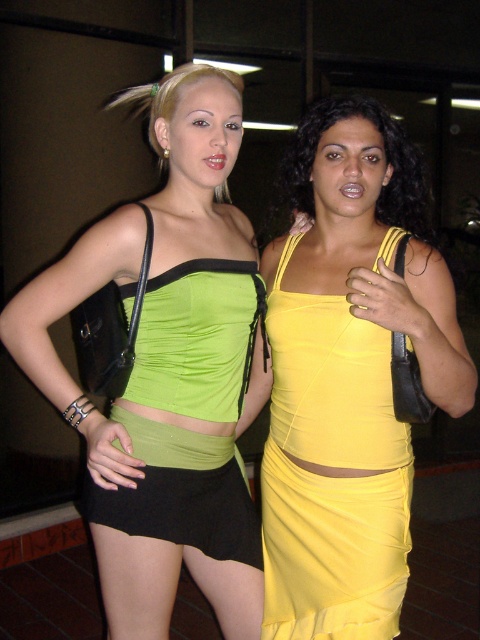
Question: Which object is positioned farthest from the green satin dress at center?

Choices:
 (A) green matte fabric top at center
 (B) yellow satin dress at right
 (C) yellow satin dress at center

Answer: (C)

Question: Does yellow satin dress at right appear on the left side of green satin dress at center?

Choices:
 (A) no
 (B) yes

Answer: (A)

Question: Which point is closer to the camera?

Choices:
 (A) green matte fabric top at center
 (B) yellow satin dress at center
 (C) yellow satin dress at right
 (D) green satin dress at center

Answer: (A)

Question: Which of the following is the farthest from the observer?

Choices:
 (A) (152, 291)
 (B) (280, 168)
 (C) (144, 627)
 (D) (386, 378)

Answer: (B)

Question: Is green matte fabric top at center bigger than green satin dress at center?

Choices:
 (A) yes
 (B) no

Answer: (A)

Question: Can you confirm if green matte fabric top at center is wider than green satin dress at center?

Choices:
 (A) yes
 (B) no

Answer: (A)